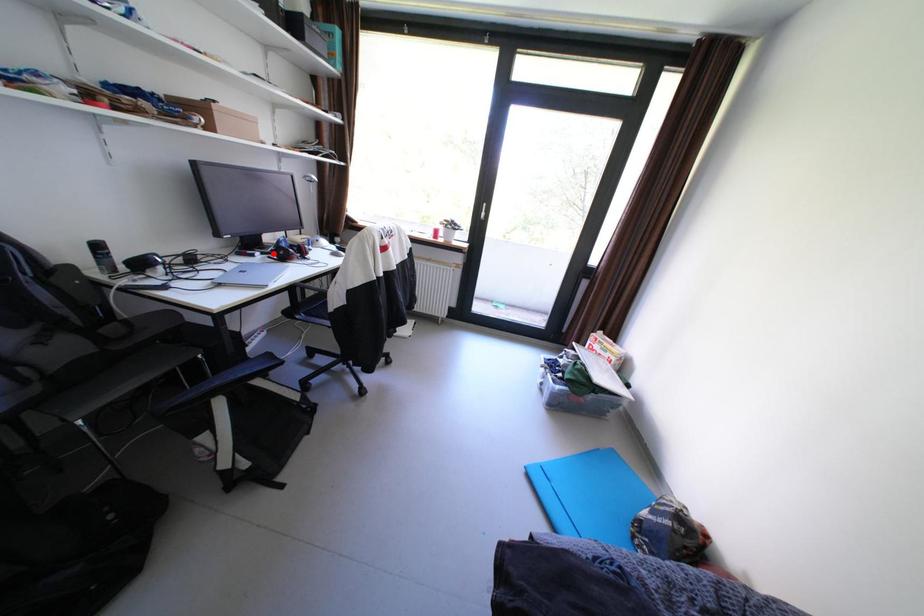
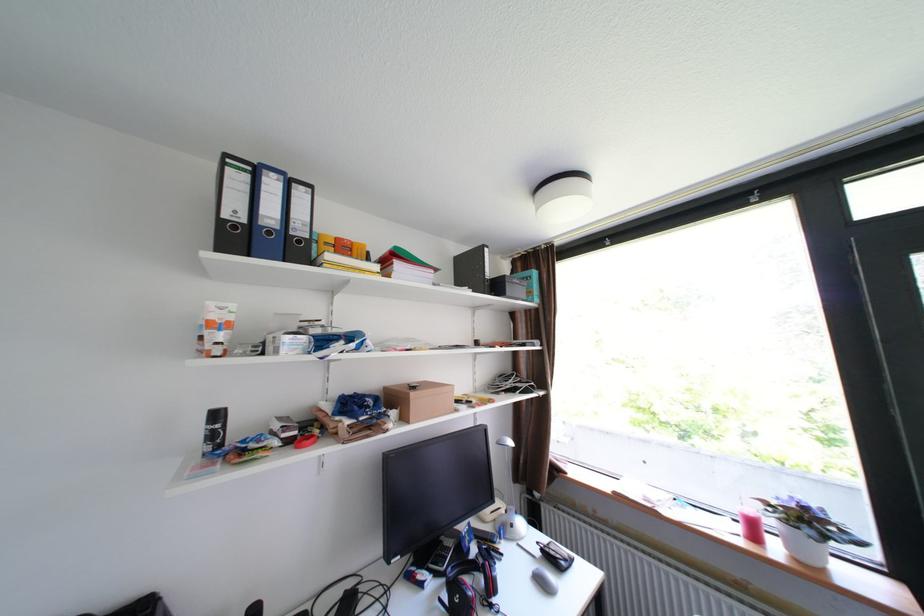
Find the pixel in the second image that matches the highlighted location in the first image.

(446, 576)